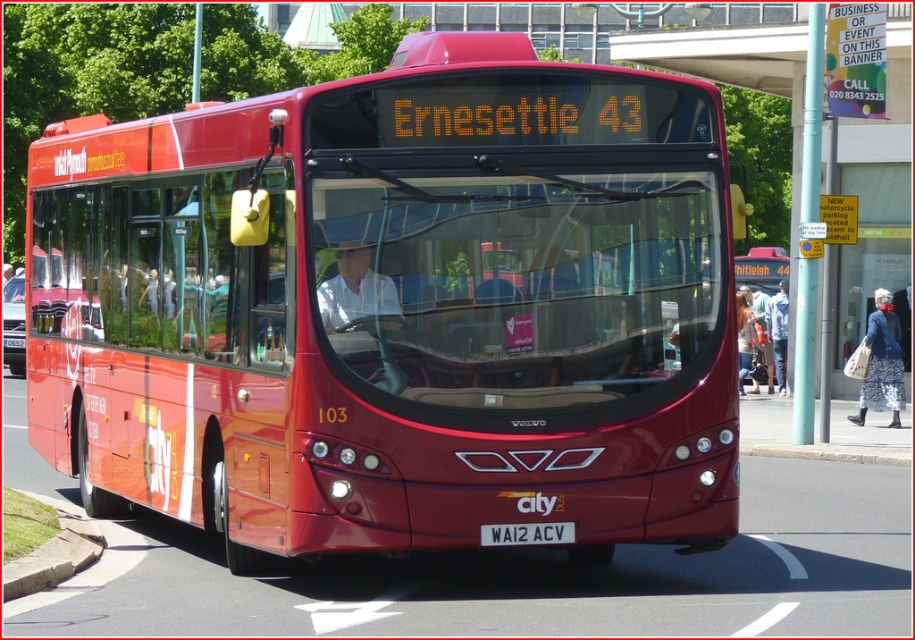
You are a pedestrian standing on the sidewalk next to the road. You see the matte red bus at center and the floral fabric dress at lower right. Which object is closer to your current position?

The floral fabric dress at lower right is closer to your current position because the matte red bus at center is above it, meaning the dress is positioned lower and nearer to the pedestrian on the sidewalk.

You are standing on the sidewalk next to the matte red bus at center. You want to cross the road to reach a bench located 50 feet away from the bus on the opposite side. Considering your distance from the bus, is the bench within a safe walking distance of 60 feet from your current position?

The matte red bus at center is 30.68 feet away from you. The bench is 50 feet away from the bus on the opposite side, so the total distance from you to the bench is 30.68 feet plus 50 feet, totaling 80.68 feet. Since this exceeds the safe walking distance of 60 feet, the bench is not within a safe distance.